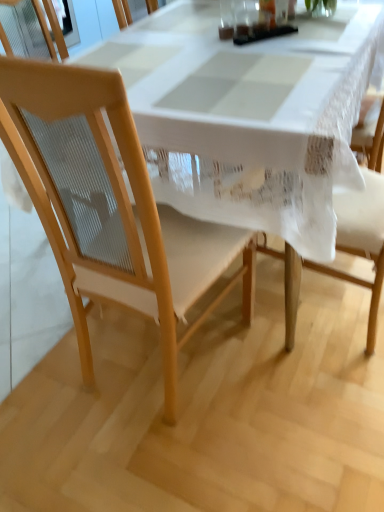
Question: Based on their positions, is white lace tablecloth at center located to the left or right of light wood chair at center?

Choices:
 (A) left
 (B) right

Answer: (B)

Question: In the image, is white lace tablecloth at center positioned in front of or behind light wood chair at center?

Choices:
 (A) front
 (B) behind

Answer: (B)

Question: Considering the positions of white lace tablecloth at center and light wood chair at center in the image, is white lace tablecloth at center bigger or smaller than light wood chair at center?

Choices:
 (A) big
 (B) small

Answer: (A)

Question: Relative to white lace tablecloth at center, is light wood chair at center in front or behind?

Choices:
 (A) front
 (B) behind

Answer: (A)

Question: Considering the positions of light wood chair at center and white lace tablecloth at center in the image, is light wood chair at center taller or shorter than white lace tablecloth at center?

Choices:
 (A) tall
 (B) short

Answer: (A)

Question: Based on their sizes in the image, would you say light wood chair at center is bigger or smaller than white lace tablecloth at center?

Choices:
 (A) small
 (B) big

Answer: (A)

Question: Which is correct: light wood chair at center is inside white lace tablecloth at center, or outside of it?

Choices:
 (A) inside
 (B) outside

Answer: (A)